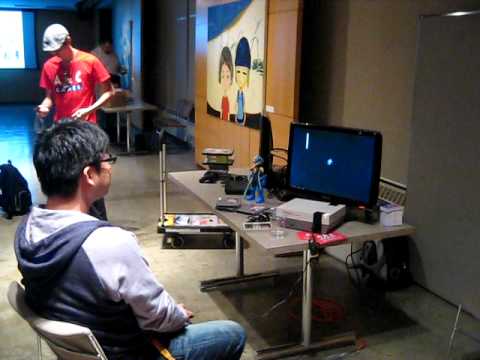
The image size is (480, 360). What are the coordinates of `floor` in the screenshot? It's located at coord(174,270).